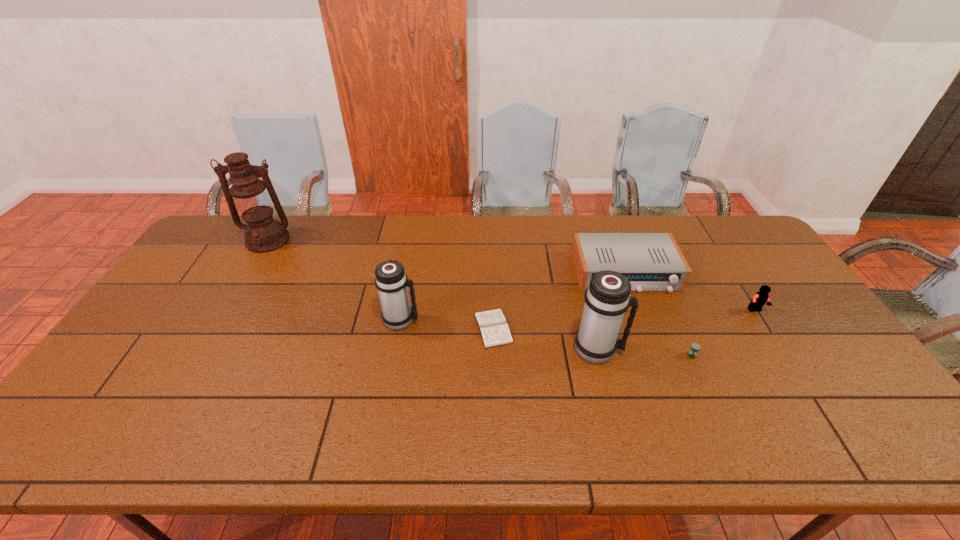
Identify the location of free space that satisfies the following two spatial constraints: 1. on the control panel of the radio receiver; 2. on the side with the handle of the taller thermos bottle. (654, 350).

Find the location of a particular element. free space that satisfies the following two spatial constraints: 1. on the control panel of the fifth tallest object; 2. on the side with the handle of the sixth object from right to left is located at coordinates (643, 321).

Find the location of `free location that satisfies the following two spatial constraints: 1. on the control panel of the beer can; 2. on the right side of the radio receiver`. free location that satisfies the following two spatial constraints: 1. on the control panel of the beer can; 2. on the right side of the radio receiver is located at coordinates (656, 355).